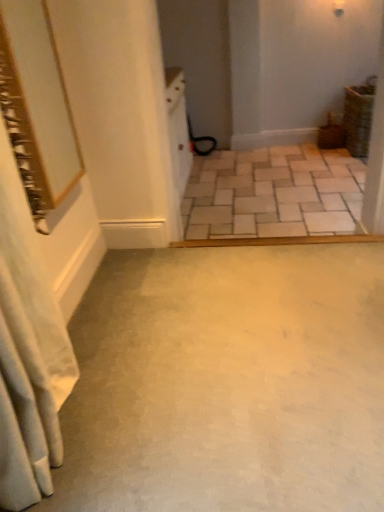
At what (x,y) coordinates should I click in order to perform the action: click on vacant area on top of smooth concrete floor at center, placed as the 1th concrete when sorted from front to back (from a real-world perspective). Please return your answer as a coordinate pair (x, y). The height and width of the screenshot is (512, 384). Looking at the image, I should click on (222, 345).